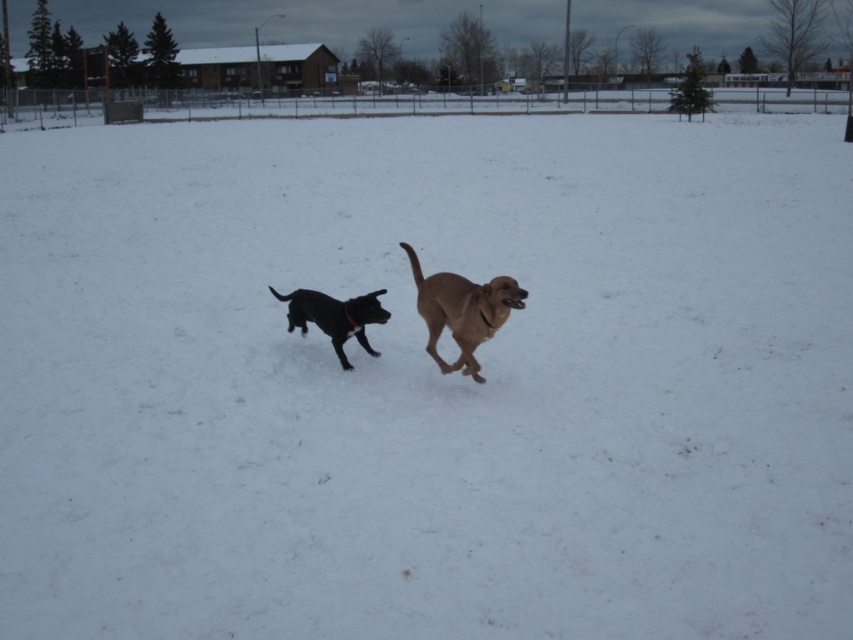
You are a photographer trying to capture both the golden brown fur at center and the shiny black dog at center in a single frame. Based on their sizes, which dog should you focus on first to ensure both are clearly visible in the photo?

The golden brown fur at center is larger than the shiny black dog at center, so focusing on the golden brown fur at center first will help ensure both are clearly visible in the photo.